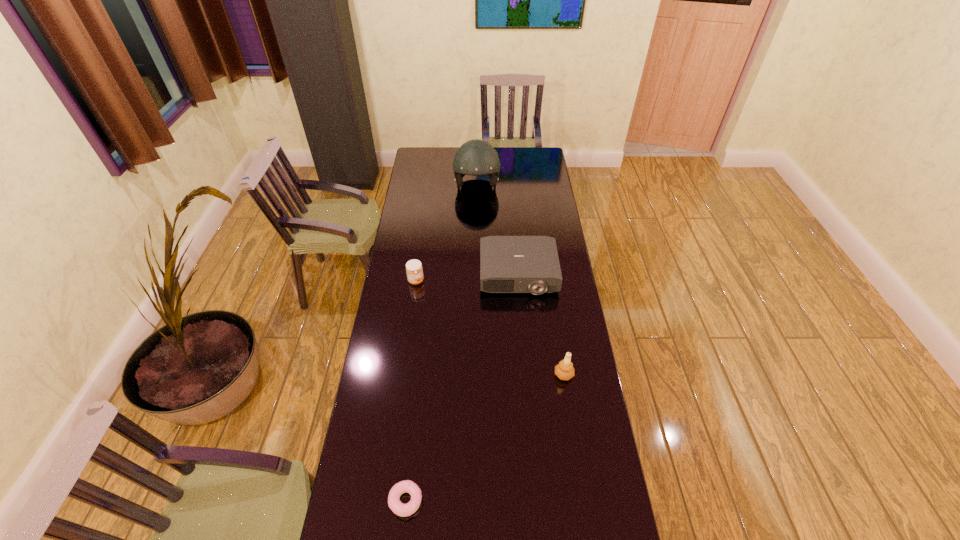
Where is `object that is the third closest one to the jam`? object that is the third closest one to the jam is located at coordinates (564, 370).

Identify the location of free spot that satisfies the following two spatial constraints: 1. on the front-facing side of the projector; 2. on the front label of the jam. This screenshot has width=960, height=540. (518, 281).

Identify the location of free region that satisfies the following two spatial constraints: 1. on the front label of the jam; 2. on the left side of the nearest object. The height and width of the screenshot is (540, 960). click(x=386, y=501).

Where is `free spot that satisfies the following two spatial constraints: 1. on the front label of the jam; 2. on the back side of the nearest object`? This screenshot has height=540, width=960. free spot that satisfies the following two spatial constraints: 1. on the front label of the jam; 2. on the back side of the nearest object is located at coordinates (386, 501).

You are a GUI agent. You are given a task and a screenshot of the screen. Output one action in this format:
    pyautogui.click(x=<x>, y=<y>)
    Task: Click on the free space that satisfies the following two spatial constraints: 1. on the front label of the jam; 2. on the back side of the second nearest object
    The height and width of the screenshot is (540, 960).
    Given the screenshot: What is the action you would take?
    pyautogui.click(x=403, y=374)

Where is `free space in the image that satisfies the following two spatial constraints: 1. on the front label of the jam; 2. on the left side of the doughnut`? Image resolution: width=960 pixels, height=540 pixels. free space in the image that satisfies the following two spatial constraints: 1. on the front label of the jam; 2. on the left side of the doughnut is located at coordinates (x=386, y=501).

Where is `free space that satisfies the following two spatial constraints: 1. at the face opening of the football helmet; 2. on the front label of the jam`? free space that satisfies the following two spatial constraints: 1. at the face opening of the football helmet; 2. on the front label of the jam is located at coordinates (476, 281).

At what (x,y) coordinates should I click in order to perform the action: click on blank area in the image that satisfies the following two spatial constraints: 1. at the face opening of the farthest object; 2. on the front label of the jam. Please return your answer as a coordinate pair (x, y). Looking at the image, I should click on (476, 281).

Locate an element on the screen. vacant space that satisfies the following two spatial constraints: 1. on the front-facing side of the projector; 2. on the right side of the candle_holder is located at coordinates (527, 374).